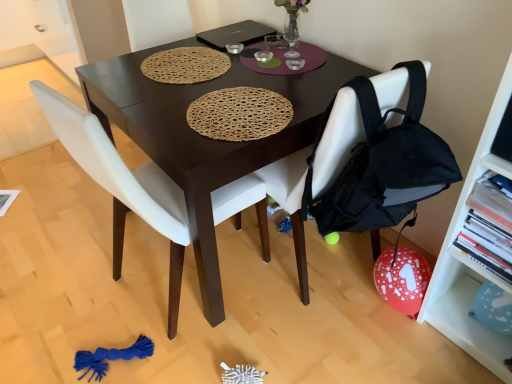
This screenshot has height=384, width=512. Describe the element at coordinates (234, 34) in the screenshot. I see `black matte laptop at upper center` at that location.

What do you see at coordinates (123, 182) in the screenshot? I see `white matte chair at center, arranged as the 2th chair when viewed from the right` at bounding box center [123, 182].

What is the approximate width of black fabric chair at center, positioned as the second chair in left-to-right order?

It is 24.33 inches.

Find the location of a particular element. The width and height of the screenshot is (512, 384). white plastic shelf at right is located at coordinates (471, 259).

From a real-world perspective, is black fabric chair at center, the first chair when ordered from right to left, on dark wood table at center?

Yes, from a real-world perspective, black fabric chair at center, the first chair when ordered from right to left, is over dark wood table at center

In the image, is black fabric chair at center, positioned as the second chair in left-to-right order, positioned in front of or behind dark wood table at center?

black fabric chair at center, positioned as the second chair in left-to-right order, is in front of dark wood table at center.

Does point (331, 123) appear closer or farther from the camera than point (300, 284)?

Point (331, 123).

Can you confirm if black fabric chair at center, positioned as the second chair in left-to-right order, is bigger than dark wood table at center?

No, black fabric chair at center, positioned as the second chair in left-to-right order, is not bigger than dark wood table at center.

Considering the sizes of objects black fabric chair at center, positioned as the second chair in left-to-right order, and white plastic shelf at right in the image provided, who is taller, black fabric chair at center, positioned as the second chair in left-to-right order, or white plastic shelf at right?

white plastic shelf at right is taller.

Who is smaller, black fabric chair at center, positioned as the second chair in left-to-right order, or white plastic shelf at right?

white plastic shelf at right.

From the image's perspective, which one is positioned lower, black fabric chair at center, the first chair when ordered from right to left, or white plastic shelf at right?

white plastic shelf at right.

Would you say black fabric chair at center, positioned as the second chair in left-to-right order, is outside white plastic shelf at right?

Yes, black fabric chair at center, positioned as the second chair in left-to-right order, is located beyond the bounds of white plastic shelf at right.

Based on the photo, from a real-world perspective, is black matte laptop at upper center over white plastic shelf at right?

Yes.

Considering the positions of point (248, 38) and point (464, 264), is point (248, 38) closer or farther from the camera than point (464, 264)?

Point (248, 38) appears to be farther away from the viewer than point (464, 264).

Is black matte laptop at upper center at the left side of white plastic shelf at right?

Correct, you'll find black matte laptop at upper center to the left of white plastic shelf at right.

Does black matte laptop at upper center turn towards white plastic shelf at right?

No, black matte laptop at upper center does not turn towards white plastic shelf at right.

Do you think white plastic shelf at right is within dark wood table at center, or outside of it?

white plastic shelf at right is not enclosed by dark wood table at center.

From the image's perspective, does white plastic shelf at right appear lower than dark wood table at center?

Correct, white plastic shelf at right appears lower than dark wood table at center in the image.

Between white plastic shelf at right and dark wood table at center, which one appears on the left side from the viewer's perspective?

dark wood table at center.

In the image, is black fabric chair at center, the first chair when ordered from right to left, positioned in front of or behind black matte laptop at upper center?

black fabric chair at center, the first chair when ordered from right to left, is in front of black matte laptop at upper center.

Are black fabric chair at center, the first chair when ordered from right to left, and black matte laptop at upper center making contact?

black fabric chair at center, the first chair when ordered from right to left, and black matte laptop at upper center are not in contact.

Is point (290, 209) closer or farther from the camera than point (213, 33)?

Point (290, 209) is positioned closer to the camera compared to point (213, 33).

Is black fabric chair at center, the first chair when ordered from right to left, turned away from black matte laptop at upper center?

No, black fabric chair at center, the first chair when ordered from right to left,'s orientation is not away from black matte laptop at upper center.

What's the angular difference between black matte laptop at upper center and black fabric chair at center, positioned as the second chair in left-to-right order,'s facing directions?

The angle between the facing direction of black matte laptop at upper center and the facing direction of black fabric chair at center, positioned as the second chair in left-to-right order, is 95.4 degrees.

Measure the distance between black matte laptop at upper center and black fabric chair at center, the first chair when ordered from right to left.

black matte laptop at upper center and black fabric chair at center, the first chair when ordered from right to left, are 29.11 inches apart from each other.

Which point is more distant from viewer, (268, 29) or (394, 86)?

The point (268, 29) is behind.

Would you say black matte laptop at upper center is outside black fabric chair at center, the first chair when ordered from right to left?

Yes.

Is white matte chair at center, the first chair positioned from the left, positioned far away from white plastic shelf at right?

No, white matte chair at center, the first chair positioned from the left, is in close proximity to white plastic shelf at right.

Which of these two, white matte chair at center, the first chair positioned from the left, or white plastic shelf at right, stands taller?

Standing taller between the two is white plastic shelf at right.

Based on the photo, how distant is white matte chair at center, the first chair positioned from the left, from white plastic shelf at right?

white matte chair at center, the first chair positioned from the left, is 35.54 inches away from white plastic shelf at right.

Is white plastic shelf at right at the back of white matte chair at center, the first chair positioned from the left?

That's not correct — white matte chair at center, the first chair positioned from the left, is not looking away from white plastic shelf at right.

This screenshot has width=512, height=384. Identify the location of desk below the black fabric chair at center, positioned as the second chair in left-to-right order (from a real-world perspective). (205, 137).

Which chair is the 2nd one when counting from the back of the white plastic shelf at right? Please provide its 2D coordinates.

[(337, 140)]

Consider the image. Considering their positions, is black matte laptop at upper center positioned further to white matte chair at center, arranged as the 2th chair when viewed from the right, than black fabric chair at center, the first chair when ordered from right to left?

black matte laptop at upper center lies further to white matte chair at center, arranged as the 2th chair when viewed from the right, than the other object.

Which object lies nearer to the anchor point dark wood table at center, black matte laptop at upper center or white plastic shelf at right?

black matte laptop at upper center is closer to dark wood table at center.

From the image, which object appears to be farther from white plastic shelf at right, white matte chair at center, the first chair positioned from the left, or black matte laptop at upper center?

Based on the image, black matte laptop at upper center appears to be further to white plastic shelf at right.

When comparing their distances from dark wood table at center, does white plastic shelf at right or black fabric chair at center, the first chair when ordered from right to left, seem further?

white plastic shelf at right is positioned further to the anchor dark wood table at center.

When comparing their distances from black matte laptop at upper center, does white plastic shelf at right or black fabric chair at center, positioned as the second chair in left-to-right order, seem closer?

black fabric chair at center, positioned as the second chair in left-to-right order, lies closer to black matte laptop at upper center than the other object.

From the image, which object appears to be nearer to black matte laptop at upper center, black fabric chair at center, the first chair when ordered from right to left, or white plastic shelf at right?

black fabric chair at center, the first chair when ordered from right to left, lies closer to black matte laptop at upper center than the other object.

Estimate the real-world distances between objects in this image. Which object is closer to white plastic shelf at right, dark wood table at center or black matte laptop at upper center?

The object closer to white plastic shelf at right is dark wood table at center.

Considering their positions, is white matte chair at center, the first chair positioned from the left, positioned further to white plastic shelf at right than dark wood table at center?

white matte chair at center, the first chair positioned from the left.

Find the location of a particular element. This screenshot has height=384, width=512. desk between white matte chair at center, arranged as the 2th chair when viewed from the right, and white plastic shelf at right, in the horizontal direction is located at coordinates (205, 137).

This screenshot has height=384, width=512. Identify the location of chair positioned between white matte chair at center, arranged as the 2th chair when viewed from the right, and black matte laptop at upper center from near to far. (337, 140).

Identify the location of desk between white plastic shelf at right and black matte laptop at upper center from front to back. The width and height of the screenshot is (512, 384). (205, 137).

Image resolution: width=512 pixels, height=384 pixels. I want to click on chair located between white matte chair at center, arranged as the 2th chair when viewed from the right, and white plastic shelf at right in the left-right direction, so 337,140.